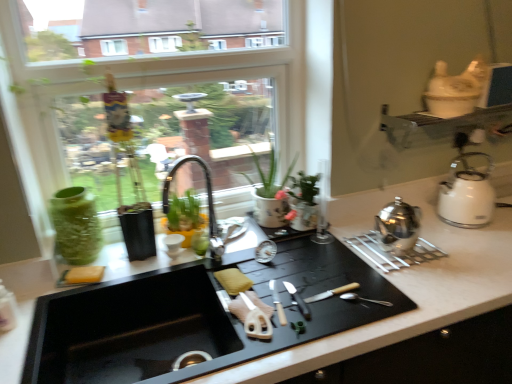
You are a GUI agent. You are given a task and a screenshot of the screen. Output one action in this format:
    pyautogui.click(x=<x>, y=<y>)
    Task: Click on the vacant space behind silver metallic knife at center, marked as the first knife in a right-to-left arrangement
    The image size is (512, 384).
    Given the screenshot: What is the action you would take?
    pyautogui.click(x=295, y=267)